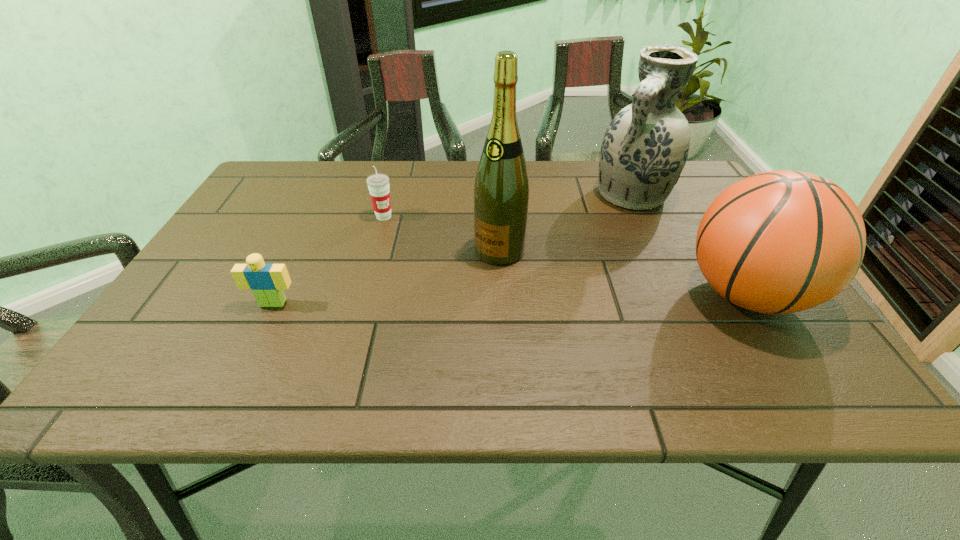
Find the location of a particular element. Lego is located at coordinates click(x=267, y=281).

Locate an element on the screen. This screenshot has width=960, height=540. the leftmost object is located at coordinates (267, 281).

Locate an element on the screen. the third shortest object is located at coordinates (778, 242).

The height and width of the screenshot is (540, 960). In order to click on cup in this screenshot , I will do `click(378, 184)`.

The height and width of the screenshot is (540, 960). In order to click on the second shortest object in this screenshot , I will do `click(378, 184)`.

Locate an element on the screen. the third object from right to left is located at coordinates (501, 191).

Image resolution: width=960 pixels, height=540 pixels. I want to click on vase, so click(x=645, y=147).

The image size is (960, 540). What are the coordinates of `vacant region located on the face of the Lego` in the screenshot? It's located at (262, 326).

Where is `free region located on the left of the basketball`? The height and width of the screenshot is (540, 960). free region located on the left of the basketball is located at coordinates (645, 295).

The width and height of the screenshot is (960, 540). In order to click on blank space located on the side of the fourth object from right to left with the logo in this screenshot , I will do `click(413, 244)`.